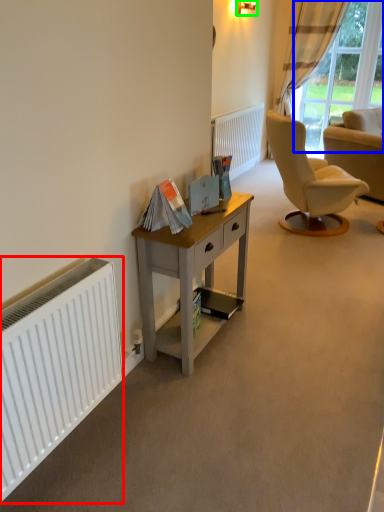
Question: Which object is positioned farthest from radiator (highlighted by a red box)? Select from bay window (highlighted by a blue box) and lamp (highlighted by a green box).

Choices:
 (A) bay window
 (B) lamp

Answer: (A)